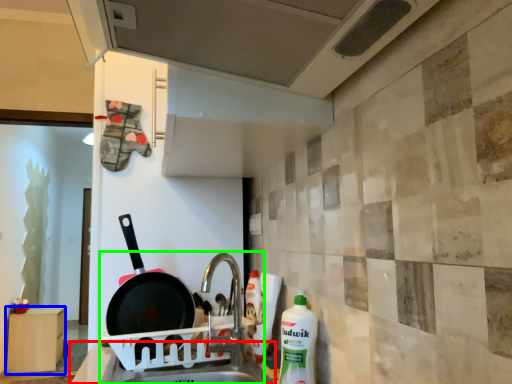
Question: Considering the real-world distances, which object is closest to counter top (highlighted by a red box)? furniture (highlighted by a blue box) or sink (highlighted by a green box).

Choices:
 (A) furniture
 (B) sink

Answer: (B)